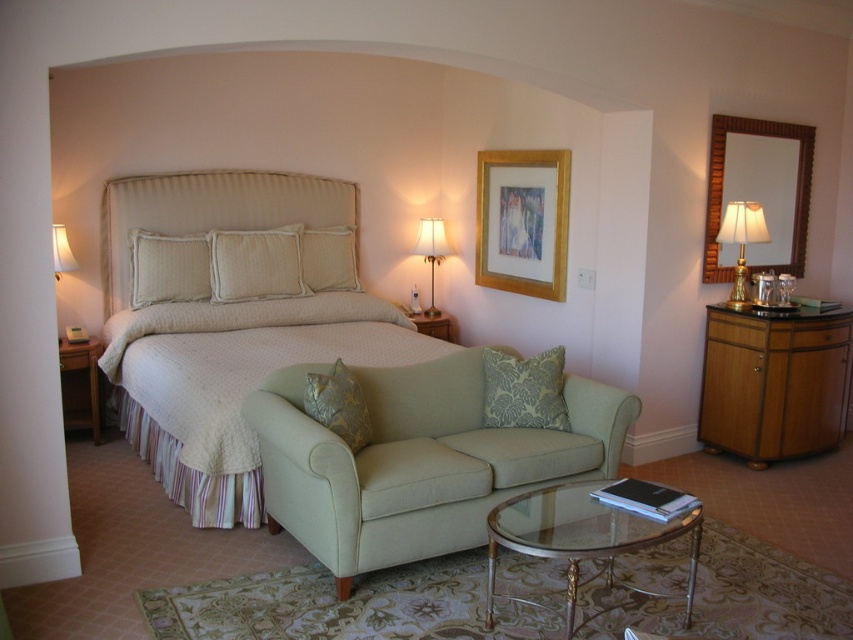
Question: Does beige quilted bed at center have a smaller size compared to textured gold pillow at center?

Choices:
 (A) yes
 (B) no

Answer: (B)

Question: Where is beige fabric pillow at center located in relation to green damask pillow at center in the image?

Choices:
 (A) right
 (B) left

Answer: (B)

Question: Which of the following is the farthest from the observer?

Choices:
 (A) (807, 374)
 (B) (524, 168)

Answer: (B)

Question: Based on their relative distances, which object is nearer to the white fabric pillow at upper left?

Choices:
 (A) beige quilted bed at center
 (B) gold wooden picture frame at upper center
 (C) beige fabric pillow at center

Answer: (C)

Question: Is gold wooden picture frame at upper center positioned before white fabric pillow at upper left?

Choices:
 (A) no
 (B) yes

Answer: (A)

Question: Which point is farther to the camera?

Choices:
 (A) (165, 243)
 (B) (498, 504)
 (C) (325, 340)

Answer: (A)